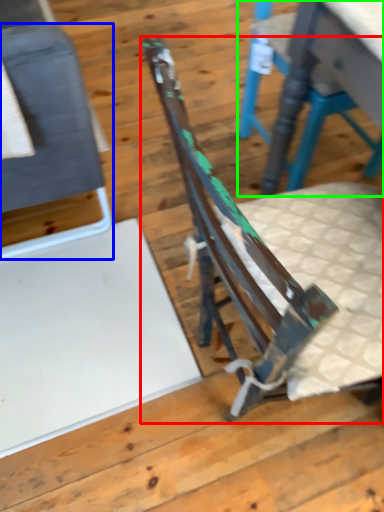
Question: Estimate the real-world distances between objects in this image. Which object is farther from chair (highlighted by a red box), chair (highlighted by a blue box) or chair (highlighted by a green box)?

Choices:
 (A) chair
 (B) chair

Answer: (B)